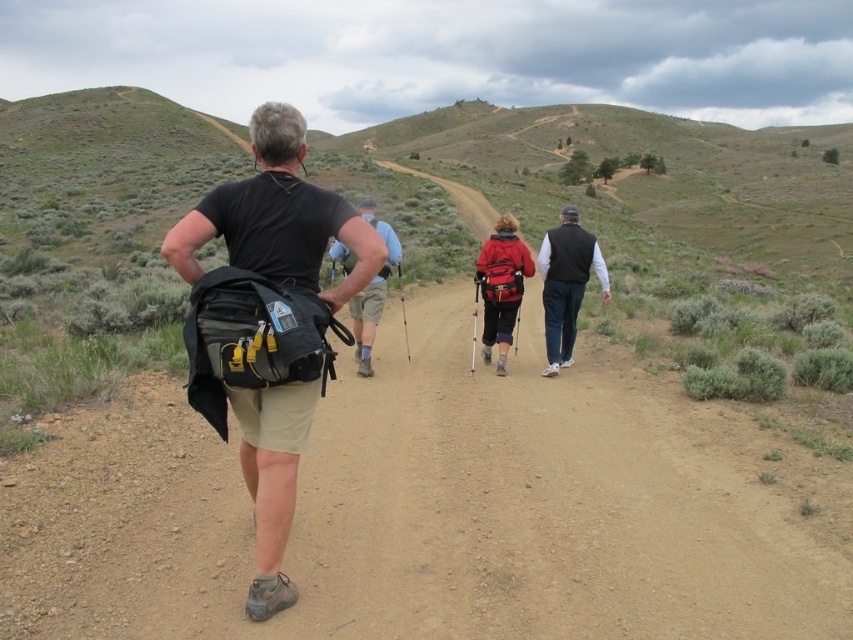
Question: Considering the real-world distances, which object is closest to the brown dirt track at center?

Choices:
 (A) dark brown vest at center
 (B) red matte backpack at center
 (C) matte black backpack at center

Answer: (C)

Question: Which point appears closest to the camera in this image?

Choices:
 (A) (380, 234)
 (B) (483, 262)
 (C) (555, 262)
 (D) (201, 332)

Answer: (D)

Question: Observing the image, what is the correct spatial positioning of brown dirt track at center in reference to matte black backpack at center?

Choices:
 (A) left
 (B) right

Answer: (A)

Question: Does brown dirt track at center have a smaller size compared to black fabric backpack at center?

Choices:
 (A) yes
 (B) no

Answer: (A)

Question: Is brown dirt track at center further to the viewer compared to dark brown vest at center?

Choices:
 (A) yes
 (B) no

Answer: (B)

Question: Which point is farther to the camera?

Choices:
 (A) (321, 518)
 (B) (209, 289)

Answer: (A)